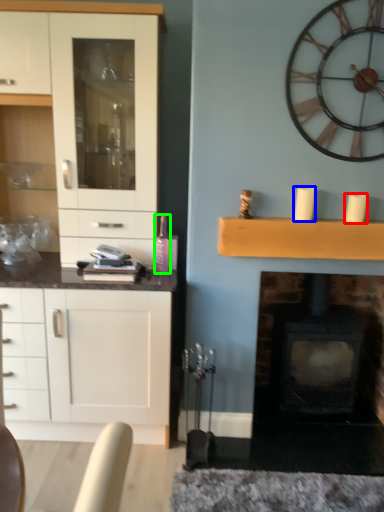
Question: Based on their relative distances, which object is nearer to candle (highlighted by a red box)? Choose from candle (highlighted by a blue box) and bottle (highlighted by a green box).

Choices:
 (A) candle
 (B) bottle

Answer: (A)